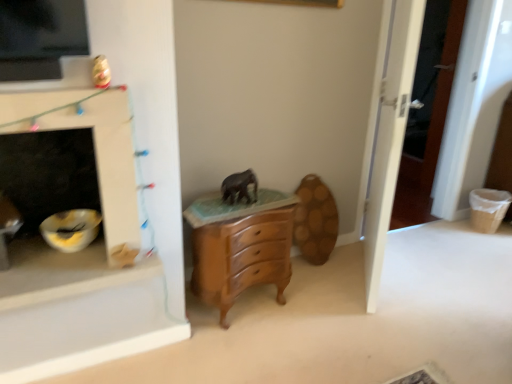
What are the coordinates of `free space in front of white wooden door at right` in the screenshot? It's located at (x=392, y=321).